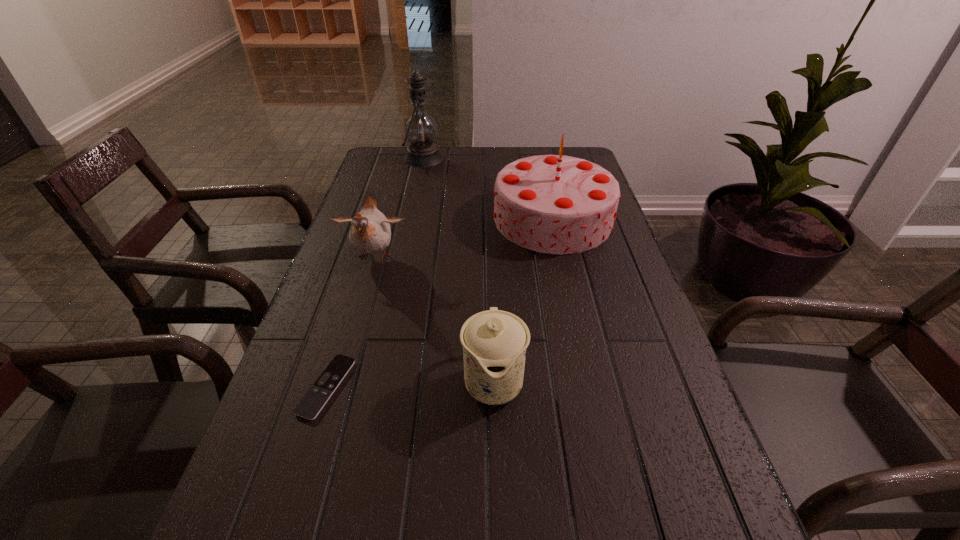
Where is `the farthest object`? Image resolution: width=960 pixels, height=540 pixels. the farthest object is located at coordinates (420, 129).

The height and width of the screenshot is (540, 960). I want to click on birthday cake, so click(x=556, y=204).

Identify the location of bird. Image resolution: width=960 pixels, height=540 pixels. (370, 232).

This screenshot has width=960, height=540. Identify the location of chinaware. (494, 342).

Where is `remote control`? This screenshot has width=960, height=540. remote control is located at coordinates (309, 407).

This screenshot has height=540, width=960. I want to click on vacant space located 0.120m on the front of the farthest object, so click(x=417, y=191).

The image size is (960, 540). Identify the location of free space located on the front of the second tallest object. (590, 389).

This screenshot has width=960, height=540. In order to click on free location located at the beak of the bird in this screenshot , I will do `click(351, 334)`.

Find the location of a particular element. blank space located 0.090m on the spout of the chinaware is located at coordinates (496, 475).

At what (x,y) coordinates should I click in order to perform the action: click on vacant space located on the right of the shortest object. Please return your answer as a coordinate pair (x, y). The width and height of the screenshot is (960, 540). Looking at the image, I should click on (420, 387).